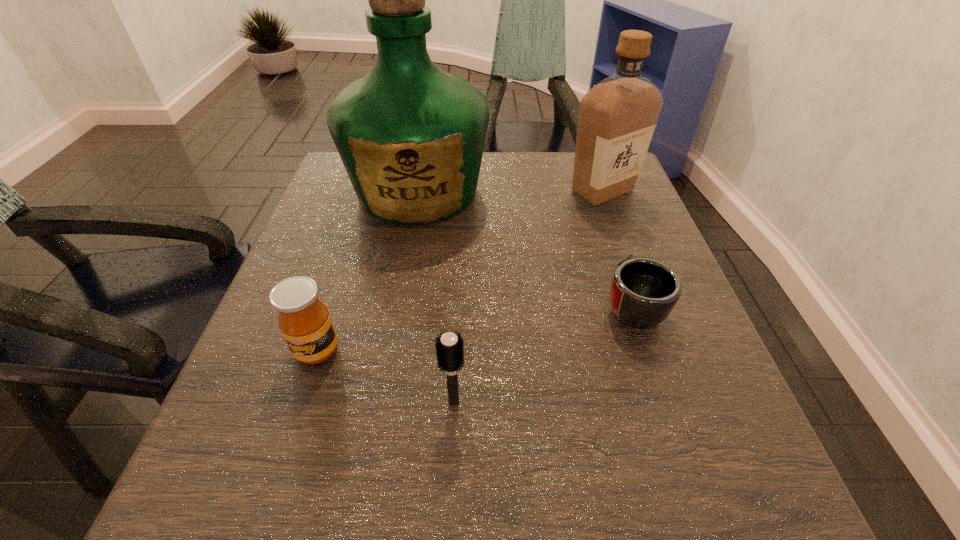
The height and width of the screenshot is (540, 960). In order to click on free point between the honey and the hairbrush in this screenshot , I will do `click(386, 376)`.

The width and height of the screenshot is (960, 540). I want to click on vacant space that is in between the honey and the shorter liquor, so click(x=460, y=271).

At what (x,y) coordinates should I click in order to perform the action: click on vacant space that's between the nearest object and the fourth shortest object. Please return your answer as a coordinate pair (x, y). This screenshot has height=540, width=960. Looking at the image, I should click on (528, 296).

Locate an element on the screen. The image size is (960, 540). free space between the fourth shortest object and the honey is located at coordinates (460, 271).

This screenshot has height=540, width=960. I want to click on free space between the mug and the left liquor, so click(525, 248).

Identify the location of vacant area that lies between the tallest object and the mug. The height and width of the screenshot is (540, 960). (525, 248).

Where is `free space between the right liquor and the nearest object`? free space between the right liquor and the nearest object is located at coordinates (528, 296).

At what (x,y) coordinates should I click in order to perform the action: click on vacant point located between the shortest object and the shorter liquor. Please return your answer as a coordinate pair (x, y). The height and width of the screenshot is (540, 960). Looking at the image, I should click on (617, 248).

Find the location of `object that is the fourth closest to the shorter liquor`. object that is the fourth closest to the shorter liquor is located at coordinates [304, 320].

At what (x,y) coordinates should I click in order to perform the action: click on the fourth closest object to the tallest object. Please return your answer as a coordinate pair (x, y). The width and height of the screenshot is (960, 540). Looking at the image, I should click on (449, 347).